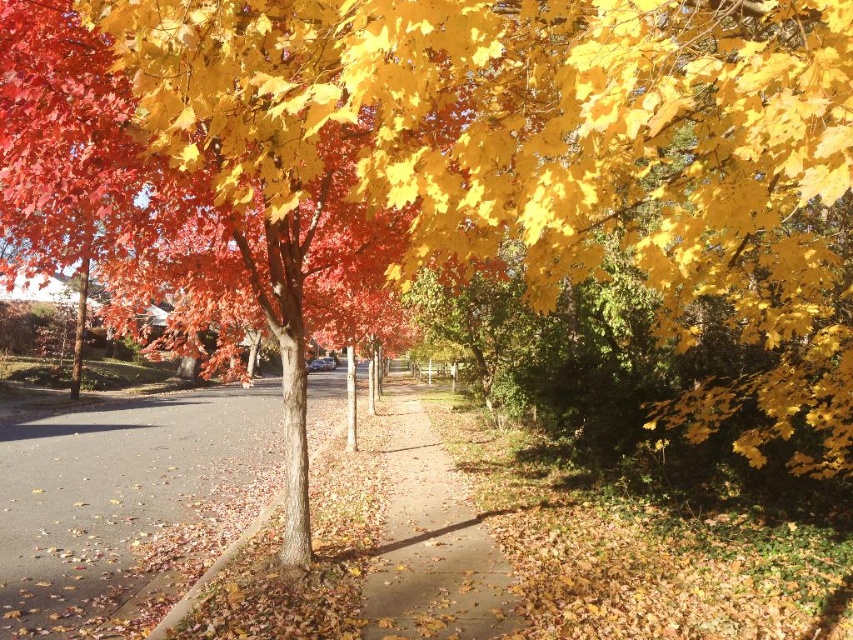
Between brown asphalt at lower left and brown dirt path at center, which one appears on the left side from the viewer's perspective?

brown asphalt at lower left

Does brown asphalt at lower left appear under brown dirt path at center?

Correct, brown asphalt at lower left is located below brown dirt path at center.

Is point (154, 547) positioned behind point (372, 566)?

Yes, point (154, 547) is behind point (372, 566).

The image size is (853, 640). I want to click on brown asphalt at lower left, so click(126, 506).